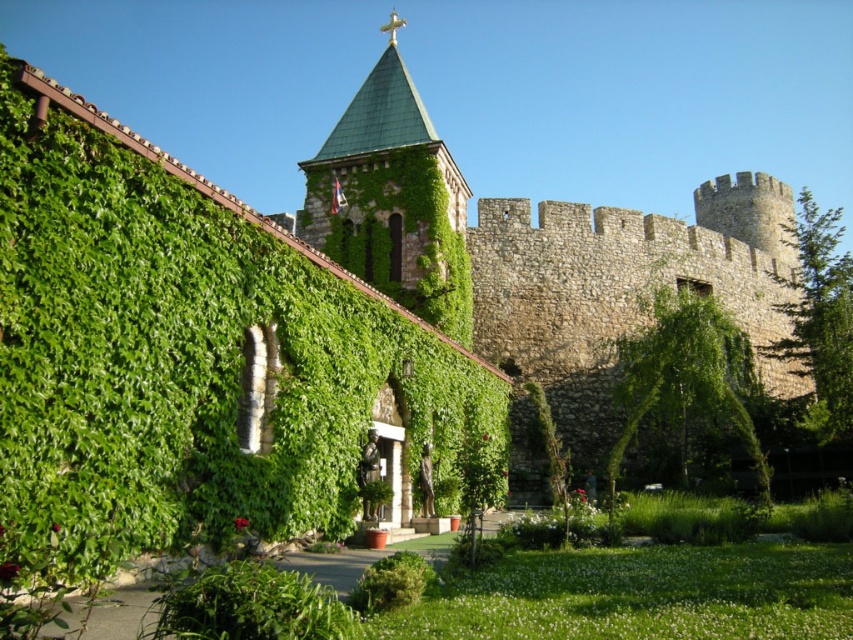
Between point (544, 300) and point (840, 307), which one is positioned in front?

Point (840, 307) is in front.

Is green ivy-covered church at center further to camera compared to green leafy tree at right?

No, it is not.

Is point (590, 244) positioned in front of point (798, 268)?

Yes, point (590, 244) is in front of point (798, 268).

You are a GUI agent. You are given a task and a screenshot of the screen. Output one action in this format:
    pyautogui.click(x=<x>, y=<y>)
    Task: Click on the green ivy-covered church at center
    The image size is (853, 640).
    Given the screenshot: What is the action you would take?
    pyautogui.click(x=541, y=253)

Does green leafy tree at center have a lesser height compared to green leafy tree at right?

Correct, green leafy tree at center is not as tall as green leafy tree at right.

Between green leafy tree at center and green leafy tree at right, which one is positioned higher?

green leafy tree at right is above.

Is point (635, 432) closer to viewer compared to point (825, 275)?

Yes, it is.

Find the location of a particular element. This screenshot has width=853, height=640. green leafy tree at center is located at coordinates (688, 378).

Can you confirm if green ivy-covered church at center is wider than green leafy tree at center?

Yes.

Describe the element at coordinates (541, 253) in the screenshot. Image resolution: width=853 pixels, height=640 pixels. I see `green ivy-covered church at center` at that location.

Describe the element at coordinates (541, 253) in the screenshot. I see `green ivy-covered church at center` at that location.

This screenshot has width=853, height=640. I want to click on green ivy-covered church at center, so [541, 253].